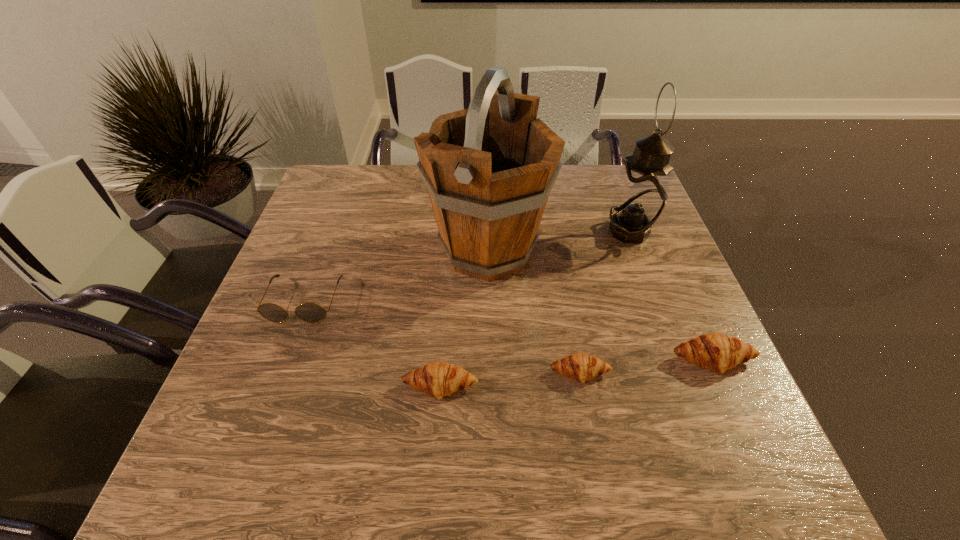
Identify the location of free space between the fifth tallest object and the bucket. The width and height of the screenshot is (960, 540). (465, 319).

I want to click on free area in between the shortest pastry and the rightmost pastry, so click(x=646, y=367).

Where is `object that is the fifth closest one to the sunglasses`? This screenshot has height=540, width=960. object that is the fifth closest one to the sunglasses is located at coordinates (717, 352).

Identify which object is the third closest to the leftmost object. Please provide its 2D coordinates. Your answer should be formatted as a tuple, i.e. [(x, y)], where the tuple contains the x and y coordinates of a point satisfying the conditions above.

[(581, 367)]

Select which pastry appears as the closest to the shortest pastry. Please provide its 2D coordinates. Your answer should be formatted as a tuple, i.e. [(x, y)], where the tuple contains the x and y coordinates of a point satisfying the conditions above.

[(717, 352)]

Identify which pastry is located as the nearest to the second pastry from left to right. Please provide its 2D coordinates. Your answer should be formatted as a tuple, i.e. [(x, y)], where the tuple contains the x and y coordinates of a point satisfying the conditions above.

[(717, 352)]